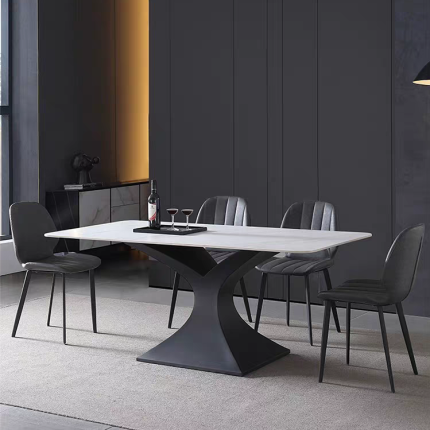
Find the location of `floor`. floor is located at coordinates (37, 416).